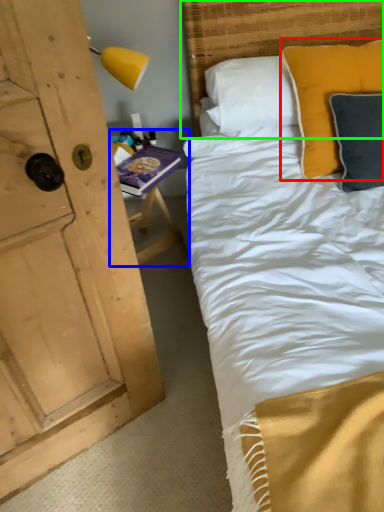
Question: Estimate the real-world distances between objects in this image. Which object is closer to pillow (highlighted by a red box), table (highlighted by a blue box) or headboard (highlighted by a green box)?

Choices:
 (A) table
 (B) headboard

Answer: (B)